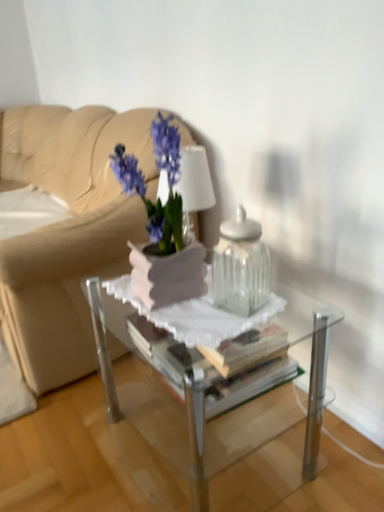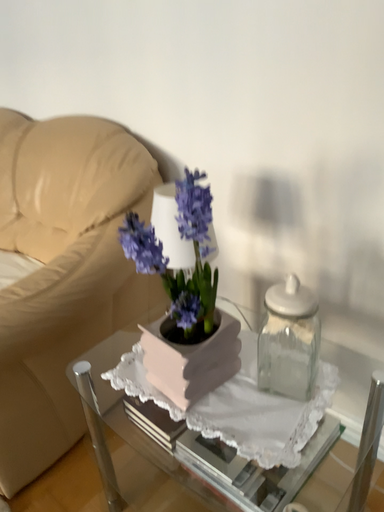
Question: Which way did the camera rotate in the video?

Choices:
 (A) rotated left
 (B) rotated right

Answer: (B)